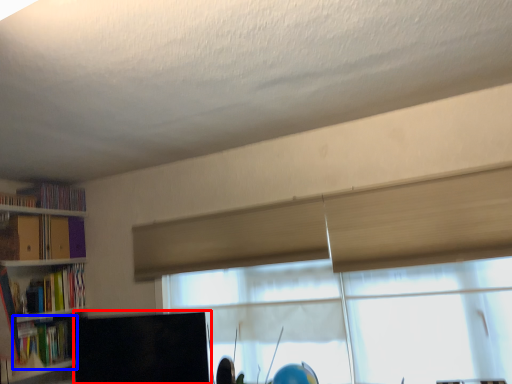
Question: Among these objects, which one is nearest to the camera, computer monitor (highlighted by a red box) or book (highlighted by a blue box)?

Choices:
 (A) computer monitor
 (B) book

Answer: (A)